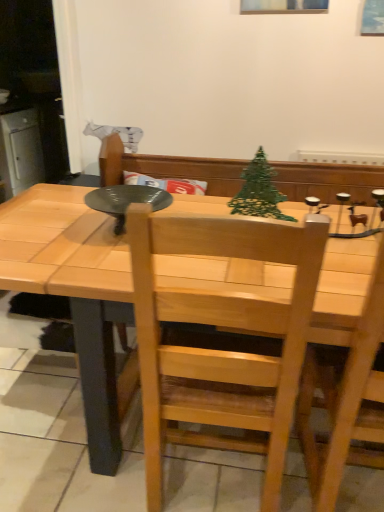
At what (x,y) coordinates should I click in order to perform the action: click on free space above natural wood table at center (from a real-world perspective). Please return your answer as a coordinate pair (x, y). Image resolution: width=384 pixels, height=512 pixels. Looking at the image, I should click on (122, 241).